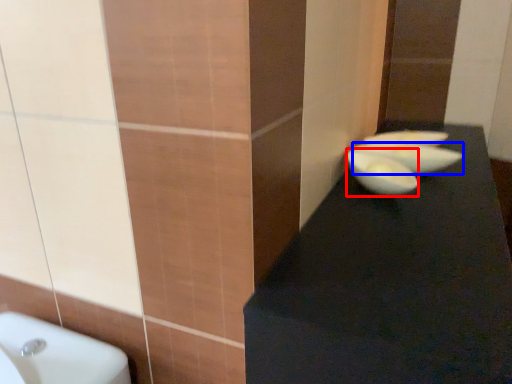
Question: Among these objects, which one is farthest to the camera, glass bowl (highlighted by a red box) or basin (highlighted by a blue box)?

Choices:
 (A) glass bowl
 (B) basin

Answer: (B)